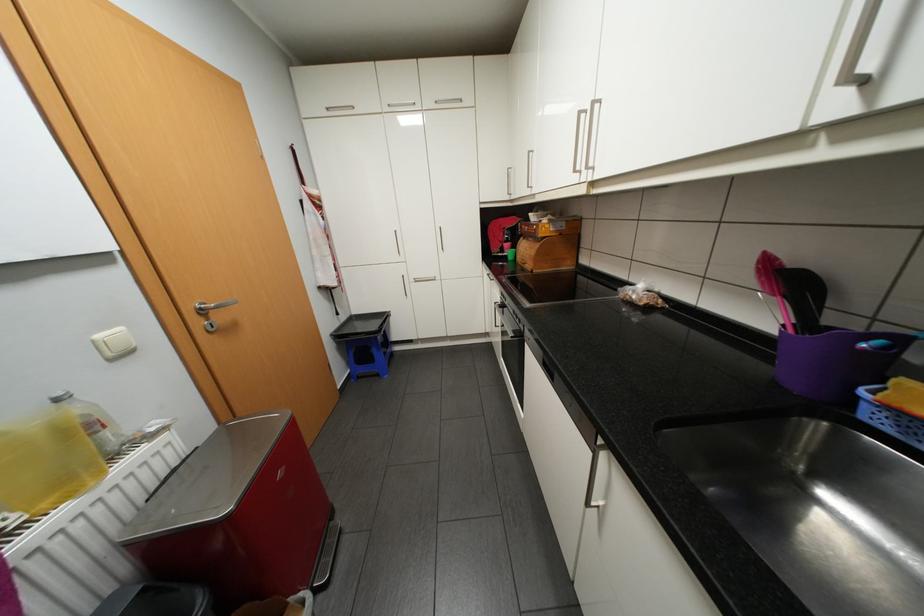
Where is `silver door handle`? silver door handle is located at coordinates (213, 306).